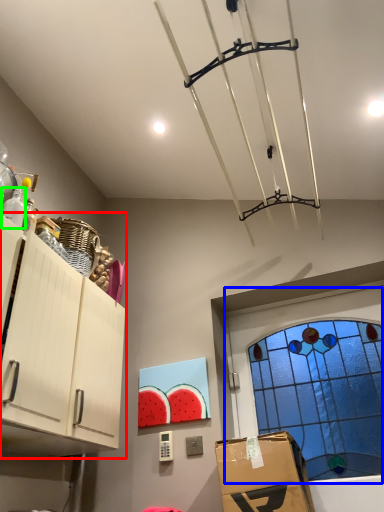
Question: Which object is positioned closest to cabinetry (highlighted by a red box)? Select from window (highlighted by a blue box) and bottle (highlighted by a green box).

Choices:
 (A) window
 (B) bottle

Answer: (B)